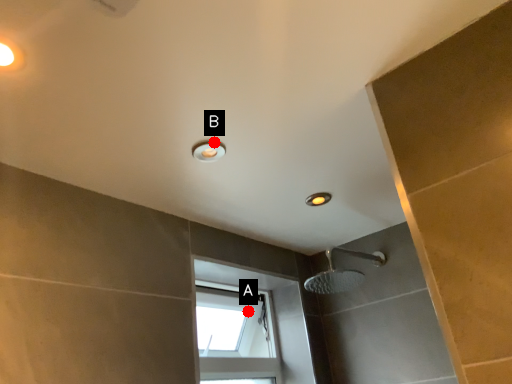
Question: Two points are circled on the image, labeled by A and B beside each circle. Which point is farther from the camera taking this photo?

Choices:
 (A) A is further
 (B) B is further

Answer: (A)